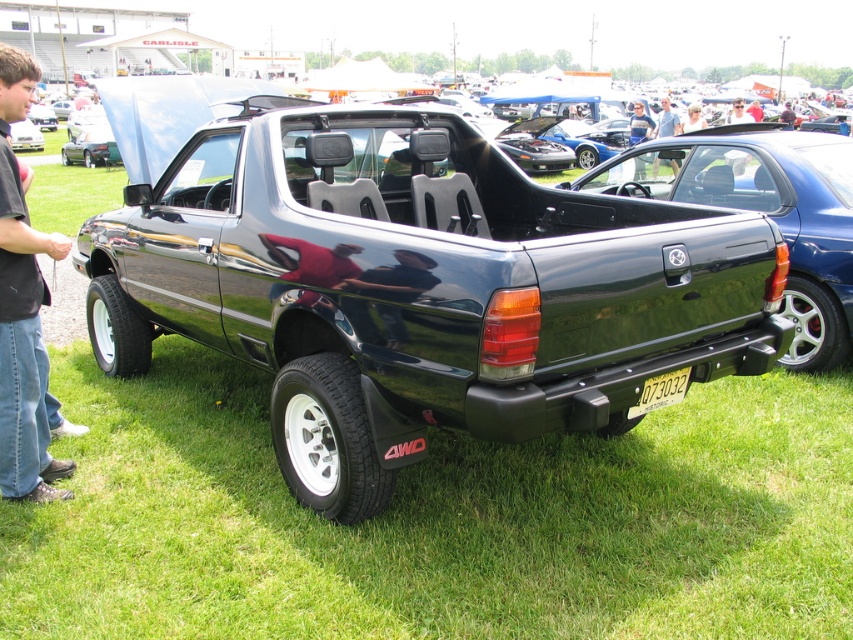
Based on the photo, does metallic green pickup truck at center have a larger size compared to yellow metallic license plate at center?

Indeed, metallic green pickup truck at center has a larger size compared to yellow metallic license plate at center.

Find the location of a particular element. The width and height of the screenshot is (853, 640). metallic green pickup truck at center is located at coordinates (767, 214).

Between point (643, 116) and point (737, 172), which one is positioned behind?

The point (643, 116) is more distant.

Does point (630, 120) come closer to viewer compared to point (730, 118)?

Yes, it is.

Where is `blue jeans at center`? This screenshot has width=853, height=640. blue jeans at center is located at coordinates (639, 124).

Which is below, metallic green pickup truck at center or gray fabric shirt at upper center?

Positioned lower is metallic green pickup truck at center.

Does metallic green pickup truck at center appear on the right side of gray fabric shirt at upper center?

Incorrect, metallic green pickup truck at center is not on the right side of gray fabric shirt at upper center.

Who is more forward, (798, 276) or (664, 100)?

Point (798, 276)

Find the location of a particular element. The image size is (853, 640). metallic green pickup truck at center is located at coordinates (767, 214).